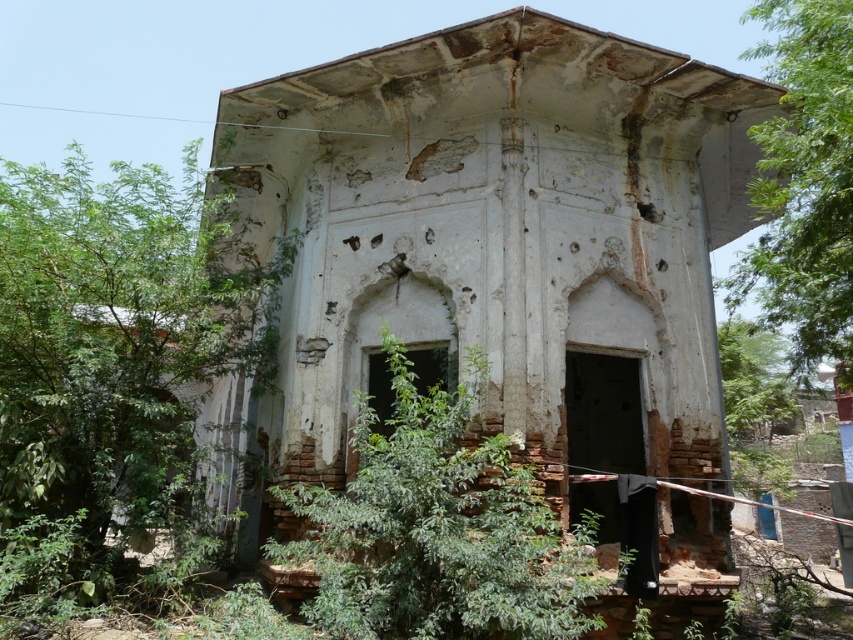
Question: In this image, where is green leafy tree at left located relative to green leafy tree at upper right?

Choices:
 (A) above
 (B) below

Answer: (B)

Question: Which object is the closest to the white weathered wall at center?

Choices:
 (A) green leafy tree at upper right
 (B) green leafy tree at left
 (C) green leafy tree at center

Answer: (B)

Question: Does white weathered wall at center appear under green leafy tree at left?

Choices:
 (A) yes
 (B) no

Answer: (A)

Question: Considering the real-world distances, which object is closest to the green leafy tree at center?

Choices:
 (A) green leafy tree at upper right
 (B) white weathered wall at center
 (C) green leafy tree at left

Answer: (C)

Question: Which object is closer to the camera taking this photo?

Choices:
 (A) white weathered wall at center
 (B) green leafy tree at left
 (C) green leafy tree at upper right
 (D) green leafy tree at center

Answer: (D)

Question: Is the position of white weathered wall at center more distant than that of green leafy tree at left?

Choices:
 (A) no
 (B) yes

Answer: (B)